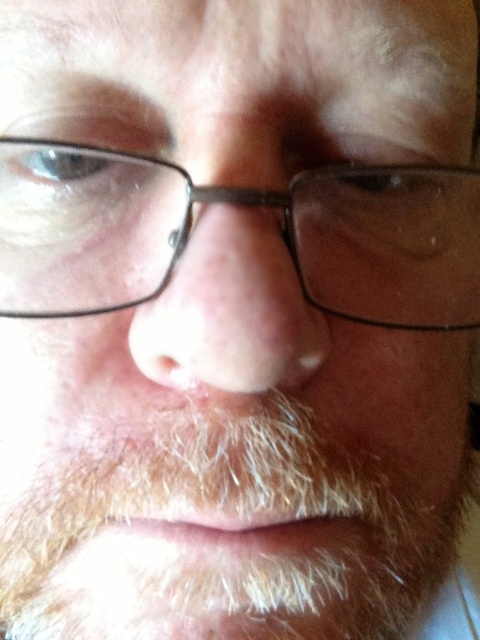
You are a photographer adjusting the focus of your camera. You need to ensure both the white fuzzy beard at lower center and the black plastic glasses at center are in focus. Which object should you adjust the focus to first to account for their size?

The white fuzzy beard at lower center has a greater height compared to the black plastic glasses at center, so you should focus on the larger object first to ensure both are in focus.

You are a photographer adjusting your camera settings for a close portrait. You have a focus point at point (312, 205). If the focus point must be within 10 inches to ensure sharpness, will this distance work?

The distance of point (312, 205) from the camera is 10.28 inches, which is slightly beyond the 10 inch threshold, so the focus point may not be sharp enough.

You are a dermatologist examining a patient. You notice the white fuzzy beard at lower center and the smooth skin nose at center. Which facial feature is closer to your eyes during the examination?

The white fuzzy beard at lower center is closer to you than the smooth skin nose at center because it is further to the viewer.